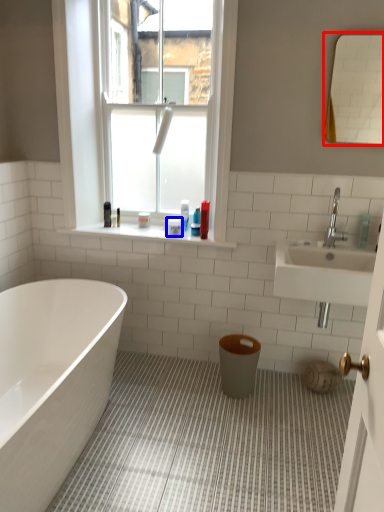
Question: Which of the following is the farthest to the observer, mirror (highlighted by a red box) or toiletry (highlighted by a blue box)?

Choices:
 (A) mirror
 (B) toiletry

Answer: (B)